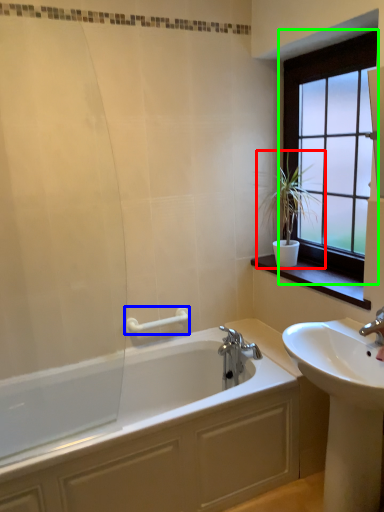
Question: Based on their relative distances, which object is farther from houseplant (highlighted by a red box)? Choose from towel bar (highlighted by a blue box) and window (highlighted by a green box).

Choices:
 (A) towel bar
 (B) window

Answer: (A)